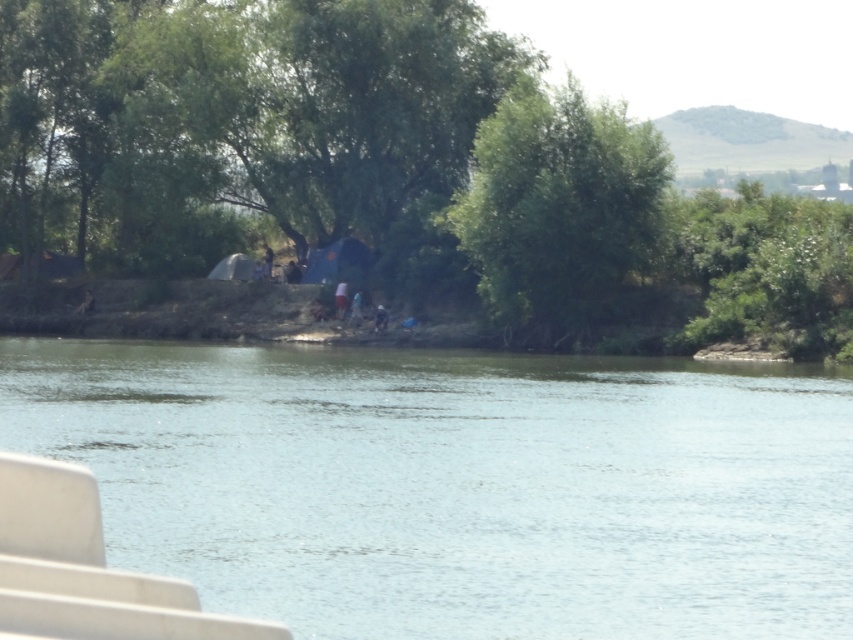
Question: Does green leafy tree at center come in front of green leafy tree at upper center?

Choices:
 (A) no
 (B) yes

Answer: (B)

Question: Which is nearer to the green leafy tree at upper center?

Choices:
 (A) green leafy tree at center
 (B) green leafy tree at upper right

Answer: (A)

Question: Does green leafy tree at upper center have a greater width compared to green leafy tree at upper right?

Choices:
 (A) yes
 (B) no

Answer: (B)

Question: Is green water at center further to camera compared to green leafy tree at upper right?

Choices:
 (A) no
 (B) yes

Answer: (A)

Question: Among these points, which one is nearest to the camera?

Choices:
 (A) (511, 186)
 (B) (231, 381)
 (C) (850, 236)

Answer: (B)

Question: Estimate the real-world distances between objects in this image. Which object is farther from the green leafy tree at upper right?

Choices:
 (A) green water at center
 (B) green leafy tree at center

Answer: (A)